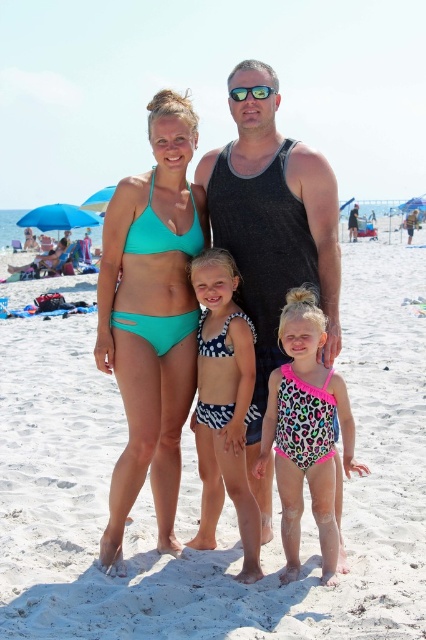
Can you confirm if white sand at center is positioned to the left of teal bikini top at center?

Correct, you'll find white sand at center to the left of teal bikini top at center.

Which of these two, white sand at center or teal bikini top at center, stands shorter?

teal bikini top at center

I want to click on white sand at center, so click(x=226, y=497).

Is white sand at center smaller than pink leopard print swimsuit at center?

Actually, white sand at center might be larger than pink leopard print swimsuit at center.

Can you confirm if white sand at center is positioned to the right of pink leopard print swimsuit at center?

Incorrect, white sand at center is not on the right side of pink leopard print swimsuit at center.

Describe the element at coordinates (226, 497) in the screenshot. Image resolution: width=426 pixels, height=640 pixels. I see `white sand at center` at that location.

Locate an element on the screen. white sand at center is located at coordinates (226, 497).

Which is behind, point (374, 602) or point (249, 410)?

Positioned behind is point (249, 410).

Who is more forward, (14,630) or (239,422)?

Point (14,630) is in front.

Who is more distant from viewer, (403, 492) or (247, 408)?

The point (403, 492) is more distant.

Locate an element on the screen. The height and width of the screenshot is (640, 426). white sand at center is located at coordinates (x=226, y=497).